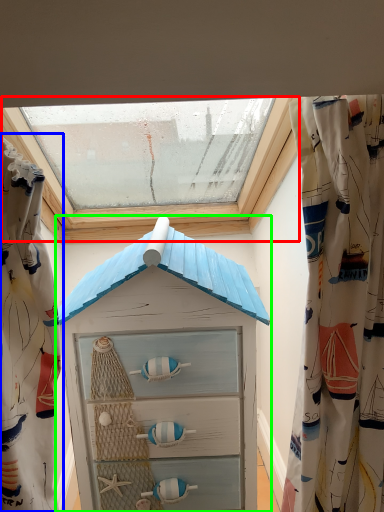
Question: Which object is the farthest from window (highlighted by a red box)? Choose among these: curtain (highlighted by a blue box) or beach hut (highlighted by a green box).

Choices:
 (A) curtain
 (B) beach hut

Answer: (A)